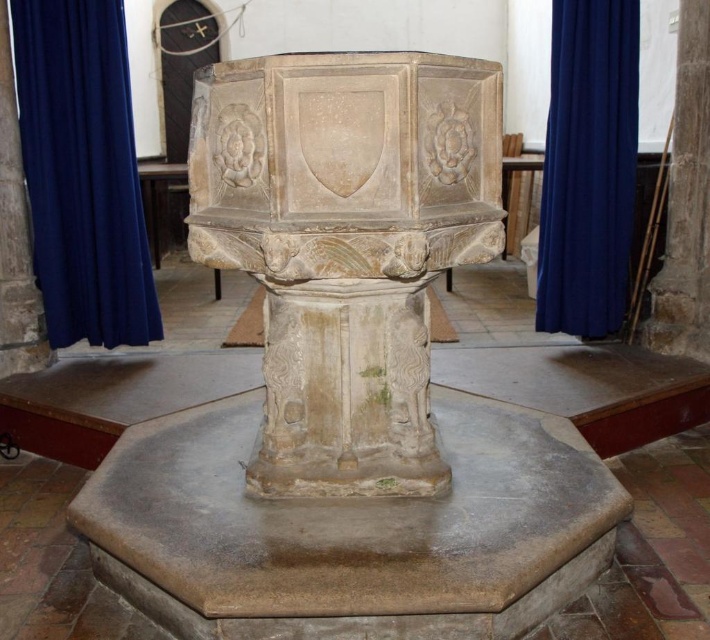
Does blue fabric curtain at left appear on the right side of blue fabric curtain at right?

No, blue fabric curtain at left is not to the right of blue fabric curtain at right.

Is blue fabric curtain at left further to the viewer compared to blue fabric curtain at right?

No, blue fabric curtain at left is closer to the viewer.

Between point (136, 314) and point (586, 100), which one is positioned behind?

The point (136, 314) is behind.

Where is `blue fabric curtain at left`? blue fabric curtain at left is located at coordinates (82, 172).

Between stone carved baptismal font at center and blue fabric curtain at left, which one is positioned lower?

stone carved baptismal font at center is lower down.

Measure the distance between point (234, 177) and camera.

Point (234, 177) is 6.50 feet from camera.

The image size is (710, 640). Identify the location of stone carved baptismal font at center. (344, 244).

Find the location of a particular element. stone carved baptismal font at center is located at coordinates (344, 244).

Which is in front, point (196, 212) or point (604, 161)?

Point (196, 212) is in front.

Is the position of stone carved baptismal font at center more distant than that of blue fabric curtain at right?

No, it is in front of blue fabric curtain at right.

Find the location of `stone carved baptismal font at center`. stone carved baptismal font at center is located at coordinates point(344,244).

The height and width of the screenshot is (640, 710). What are the coordinates of `stone carved baptismal font at center` in the screenshot? It's located at (344, 244).